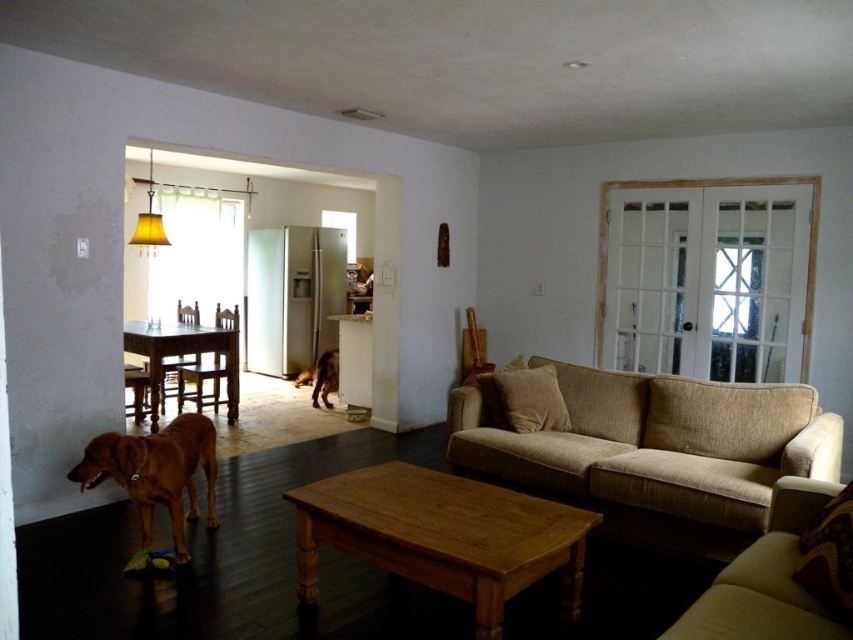
Is brown furry dog at lower left closer to camera compared to brown wood chair at left?

Yes, brown furry dog at lower left is closer to the viewer.

What do you see at coordinates (155, 472) in the screenshot?
I see `brown furry dog at lower left` at bounding box center [155, 472].

Image resolution: width=853 pixels, height=640 pixels. Find the location of `brown furry dog at lower left`. brown furry dog at lower left is located at coordinates (155, 472).

Who is positioned more to the left, beige fabric couch at center or brown furry dog at lower left?

From the viewer's perspective, brown furry dog at lower left appears more on the left side.

Does beige fabric couch at center come behind brown furry dog at lower left?

Yes, beige fabric couch at center is behind brown furry dog at lower left.

Describe the element at coordinates (657, 452) in the screenshot. The image size is (853, 640). I see `beige fabric couch at center` at that location.

This screenshot has width=853, height=640. Find the location of `beige fabric couch at center`. beige fabric couch at center is located at coordinates (657, 452).

Who is taller, beige fabric couch at center or wooden coffee table at center?

beige fabric couch at center

You are a GUI agent. You are given a task and a screenshot of the screen. Output one action in this format:
    pyautogui.click(x=<x>, y=<y>)
    Task: Click on the beige fabric couch at center
    Image resolution: width=853 pixels, height=640 pixels.
    Given the screenshot: What is the action you would take?
    pyautogui.click(x=657, y=452)